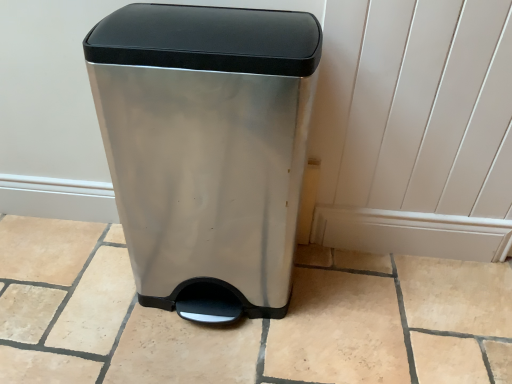
Locate an element on the screen. This screenshot has width=512, height=384. free spot to the left of satin silver trash can at center is located at coordinates (73, 293).